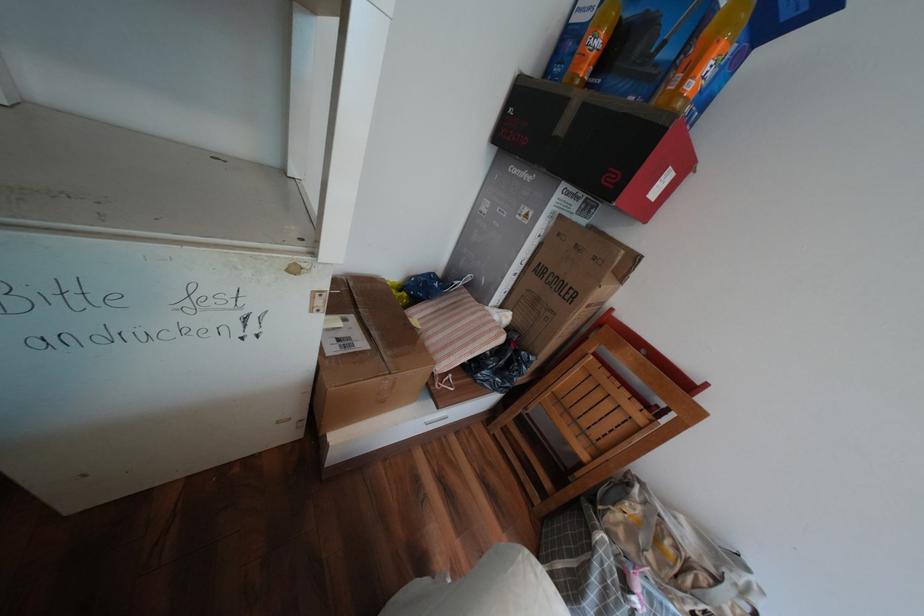
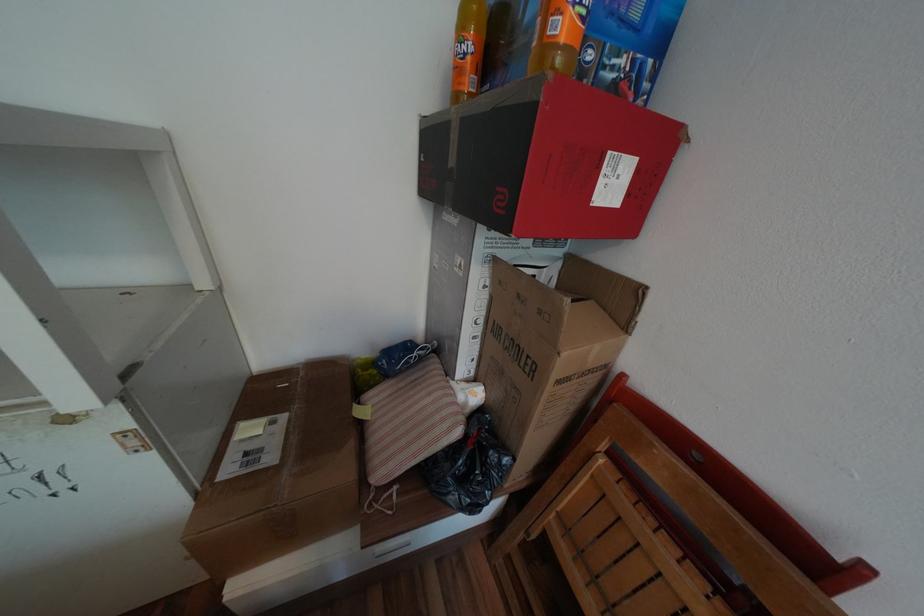
Where in the second image is the point corresponding to point (603, 257) from the first image?

(550, 312)